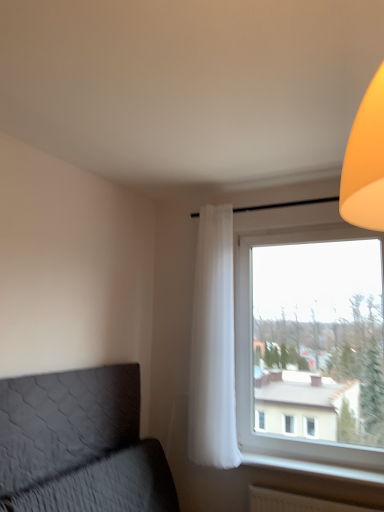
In order to face dark gray quilted headboard at lower left, should I rotate leftwards or rightwards?

Rotate left and turn 14.448 degrees.

The image size is (384, 512). In order to click on transparent glass window at right in this screenshot , I will do `click(319, 341)`.

Where is `white sheer curtain at center`? white sheer curtain at center is located at coordinates pyautogui.click(x=213, y=345).

What do you see at coordinates (213, 345) in the screenshot? I see `white sheer curtain at center` at bounding box center [213, 345].

The image size is (384, 512). Identify the location of dark gray quilted headboard at lower left. (80, 444).

Is transparent glass window at right looking in the opposite direction of white sheer curtain at center?

No.

Considering the relative sizes of transparent glass window at right and white sheer curtain at center in the image provided, is transparent glass window at right taller than white sheer curtain at center?

No, transparent glass window at right is not taller than white sheer curtain at center.

From the image's perspective, which is below, transparent glass window at right or white sheer curtain at center?

transparent glass window at right is shown below in the image.

From a real-world perspective, between transparent glass window at right and white sheer curtain at center, who is vertically lower?

transparent glass window at right.

Is dark gray quilted headboard at lower left oriented away from transparent glass window at right?

No.

Does dark gray quilted headboard at lower left touch transparent glass window at right?

No, dark gray quilted headboard at lower left is not next to transparent glass window at right.

Can you confirm if dark gray quilted headboard at lower left is bigger than transparent glass window at right?

Incorrect, dark gray quilted headboard at lower left is not larger than transparent glass window at right.

From a real-world perspective, which object rests below the other?

dark gray quilted headboard at lower left is physically lower.

The image size is (384, 512). In the image, there is a dark gray quilted headboard at lower left. In order to click on window sill below it (from a real-world perspective) in this screenshot , I will do `click(313, 468)`.

Does white plastic radiator at lower right turn towards dark gray quilted headboard at lower left?

Answer: No, white plastic radiator at lower right does not turn towards dark gray quilted headboard at lower left.

From the image's perspective, is white plastic radiator at lower right located above or below dark gray quilted headboard at lower left?

white plastic radiator at lower right is below dark gray quilted headboard at lower left.

From the picture: How different are the orientations of white plastic radiator at lower right and dark gray quilted headboard at lower left in degrees?

They differ by 89.5 degrees in their facing directions.

In the image, there is a white sheer curtain at center. At what (x,y) coordinates should I click in order to perform the action: click on window screen below it (from the image's perspective). Please return your answer as a coordinate pair (x, y). This screenshot has width=384, height=512. Looking at the image, I should click on (319, 341).

Is transparent glass window at right a part of white sheer curtain at center?

No, transparent glass window at right is not surrounded by white sheer curtain at center.

Considering the positions of objects white sheer curtain at center and transparent glass window at right in the image provided, who is more to the left, white sheer curtain at center or transparent glass window at right?

white sheer curtain at center.

What's the angular difference between white sheer curtain at center and transparent glass window at right's facing directions?

1.9 degrees.

In order to click on curtain behind the white plastic radiator at lower right in this screenshot , I will do `click(213, 345)`.

Is point (347, 474) in front of point (217, 381)?

Yes, point (347, 474) is in front of point (217, 381).

Is white plastic radiator at lower right not near white sheer curtain at center?

No, white plastic radiator at lower right is in close proximity to white sheer curtain at center.

Is white plastic radiator at lower right facing away from white sheer curtain at center?

No, white sheer curtain at center is not at the back of white plastic radiator at lower right.

Based on the photo, how different are the orientations of transparent glass window at right and dark gray quilted headboard at lower left in degrees?

The angular difference between transparent glass window at right and dark gray quilted headboard at lower left is 90 degrees.

Locate an element on the screen. window screen located above the dark gray quilted headboard at lower left (from a real-world perspective) is located at coordinates (319, 341).

Considering the sizes of objects transparent glass window at right and dark gray quilted headboard at lower left in the image provided, who is thinner, transparent glass window at right or dark gray quilted headboard at lower left?

Thinner between the two is dark gray quilted headboard at lower left.

Considering the points (291, 423) and (80, 509), which point is behind, point (291, 423) or point (80, 509)?

The point (291, 423) is farther from the camera.

Considering the relative sizes of white plastic radiator at lower right and transparent glass window at right in the image provided, is white plastic radiator at lower right bigger than transparent glass window at right?

No, white plastic radiator at lower right is not bigger than transparent glass window at right.

How different are the orientations of white plastic radiator at lower right and transparent glass window at right in degrees?

white plastic radiator at lower right and transparent glass window at right are facing 0.545 degrees away from each other.

Looking at this image, from the image's perspective, which is below, white plastic radiator at lower right or transparent glass window at right?

white plastic radiator at lower right, from the image's perspective.

Does point (380, 485) appear closer or farther from the camera than point (313, 264)?

Point (380, 485) appears to be closer to the viewer than point (313, 264).

Locate an element on the screen. The image size is (384, 512). curtain above the transparent glass window at right (from the image's perspective) is located at coordinates (213, 345).

Image resolution: width=384 pixels, height=512 pixels. In the image, there is a transparent glass window at right. Identify the location of furniture below it (from a real-world perspective). (80, 444).

In the scene shown: From the image, which object appears to be nearer to transparent glass window at right, white sheer curtain at center or white plastic radiator at lower right?

white sheer curtain at center is positioned closer to the anchor transparent glass window at right.

Which object lies nearer to the anchor point white plastic radiator at lower right, white sheer curtain at center or dark gray quilted headboard at lower left?

The object closer to white plastic radiator at lower right is white sheer curtain at center.

Estimate the real-world distances between objects in this image. Which object is closer to transparent glass window at right, dark gray quilted headboard at lower left or white sheer curtain at center?

Among the two, white sheer curtain at center is located nearer to transparent glass window at right.

Which object lies nearer to the anchor point white sheer curtain at center, transparent glass window at right or dark gray quilted headboard at lower left?

transparent glass window at right lies closer to white sheer curtain at center than the other object.

Considering their positions, is white plastic radiator at lower right positioned further to dark gray quilted headboard at lower left than transparent glass window at right?

transparent glass window at right.

Estimate the real-world distances between objects in this image. Which object is closer to dark gray quilted headboard at lower left, white sheer curtain at center or white plastic radiator at lower right?

Based on the image, white sheer curtain at center appears to be nearer to dark gray quilted headboard at lower left.

Which object lies nearer to the anchor point dark gray quilted headboard at lower left, transparent glass window at right or white sheer curtain at center?

white sheer curtain at center is positioned closer to the anchor dark gray quilted headboard at lower left.

Based on their spatial positions, is dark gray quilted headboard at lower left or white sheer curtain at center further from white plastic radiator at lower right?

dark gray quilted headboard at lower left.

Identify the location of window screen between white sheer curtain at center and white plastic radiator at lower right in the up-down direction. (319, 341).

Identify the location of window screen between dark gray quilted headboard at lower left and white plastic radiator at lower right in the horizontal direction. The width and height of the screenshot is (384, 512). (319, 341).

Where is `curtain located between dark gray quilted headboard at lower left and white plastic radiator at lower right in the left-right direction`? This screenshot has height=512, width=384. curtain located between dark gray quilted headboard at lower left and white plastic radiator at lower right in the left-right direction is located at coordinates (213, 345).

Find the location of `curtain located between dark gray quilted headboard at lower left and transparent glass window at right in the left-right direction`. curtain located between dark gray quilted headboard at lower left and transparent glass window at right in the left-right direction is located at coordinates (213, 345).